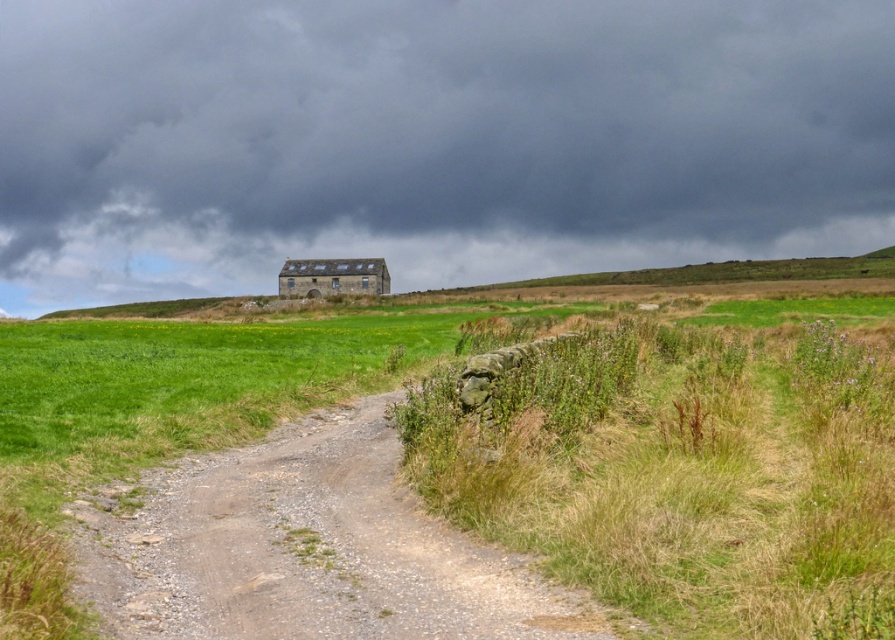
From the picture: You are a hiker who wants to take a photo of the dark gray stone wall at upper center from the dusty gravel path at center. Based on their relative heights, will the wall be mostly visible or mostly blocked from your viewpoint?

The dark gray stone wall at upper center is much taller than the dusty gravel path at center, so the wall will be mostly visible from the path since its height allows it to stand out above the path level.

You are standing at the point closer to the camera in the image. Which point are you at, point (553, 273) or point (343, 600)?

You are at point (343, 600) because it is closer to the camera than point (553, 273).